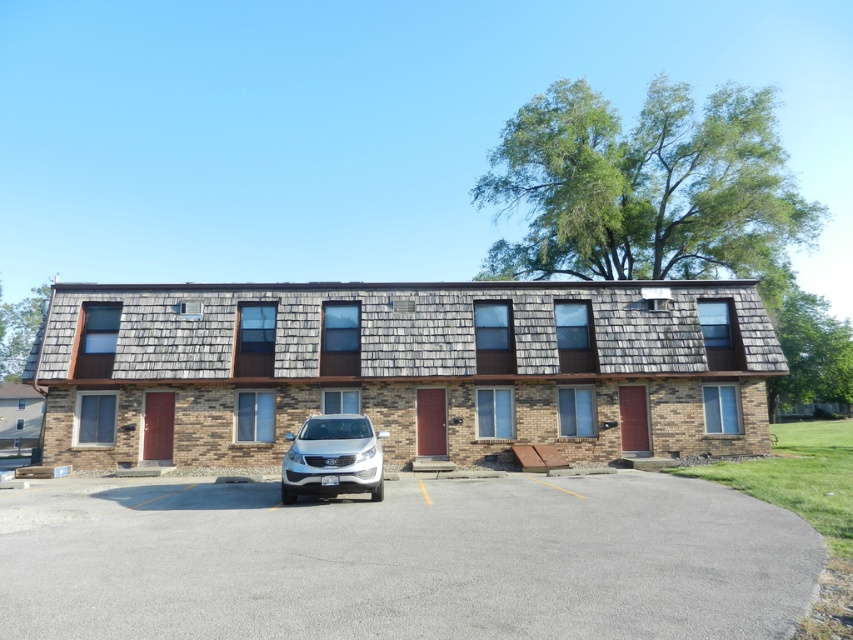
Who is more distant from viewer, (78,532) or (285,490)?

The point (285,490) is more distant.

Measure the distance between point (247, 616) and camera.

4.58 meters

Find the location of a particular element. gray asphalt parking lot at center is located at coordinates (403, 560).

At what (x,y) coordinates should I click in order to perform the action: click on gray asphalt parking lot at center. Please return your answer as a coordinate pair (x, y). Looking at the image, I should click on (403, 560).